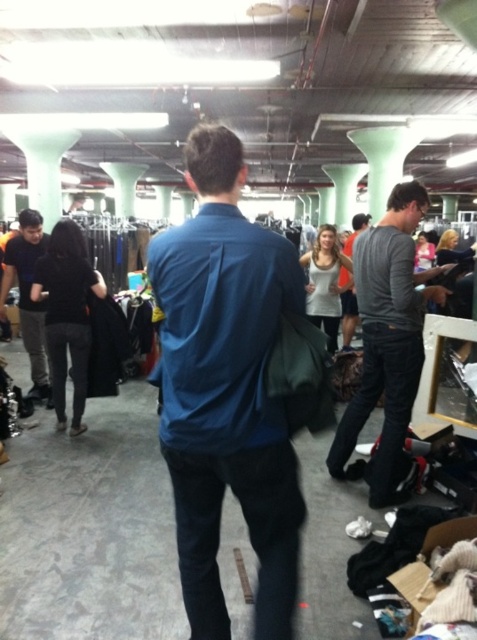
Question: Which object is closer to the camera taking this photo?

Choices:
 (A) matte black jacket at left
 (B) gray cotton shirt at right
 (C) matte gray sweater at center

Answer: (B)

Question: Which object appears farthest from the camera in this image?

Choices:
 (A) matte gray sweater at center
 (B) matte black jacket at left
 (C) gray cotton shirt at right
 (D) blue smooth shirt at center

Answer: (A)

Question: Considering the relative positions of gray cotton shirt at right and matte black jacket at left in the image provided, where is gray cotton shirt at right located with respect to matte black jacket at left?

Choices:
 (A) right
 (B) left

Answer: (A)

Question: Is blue smooth shirt at center closer to the viewer compared to gray cotton shirt at right?

Choices:
 (A) yes
 (B) no

Answer: (A)

Question: Estimate the real-world distances between objects in this image. Which object is farther from the matte black jacket at left?

Choices:
 (A) matte gray sweater at center
 (B) blue smooth shirt at center

Answer: (B)

Question: Is blue smooth shirt at center positioned in front of matte black jacket at left?

Choices:
 (A) yes
 (B) no

Answer: (A)